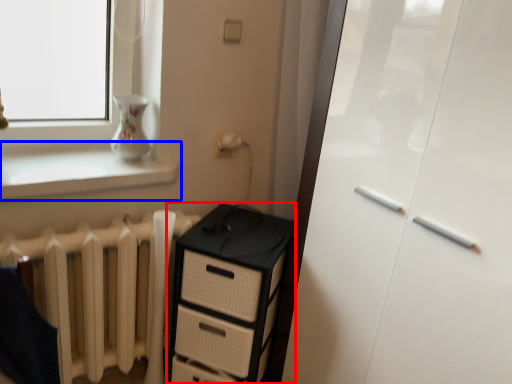
Question: Which object appears farthest to the camera in this image, chest of drawers (highlighted by a red box) or window sill (highlighted by a blue box)?

Choices:
 (A) chest of drawers
 (B) window sill

Answer: (A)